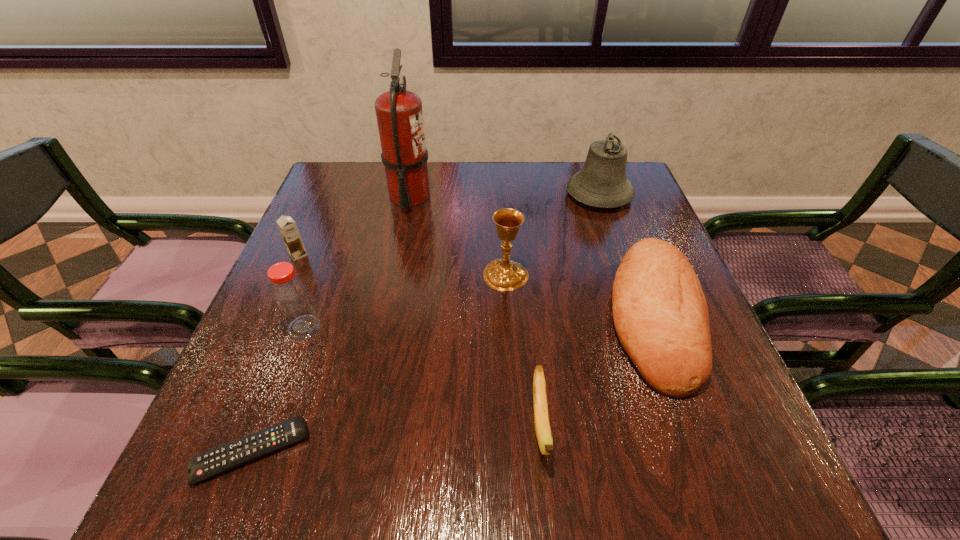
Find the location of a particular element. free space at the right edge of the desktop is located at coordinates (653, 420).

In the image, there is a desktop. Identify the location of vacant space at the far left corner. The image size is (960, 540). (358, 168).

At what (x,y) coordinates should I click in order to perform the action: click on vacant region between the bread and the chocolate milk. Please return your answer as a coordinate pair (x, y). Looking at the image, I should click on (476, 286).

The height and width of the screenshot is (540, 960). In order to click on free space that is in between the chalice and the chocolate milk in this screenshot , I will do `click(402, 265)`.

Find the location of a particular element. This screenshot has width=960, height=540. vacant space in between the chocolate milk and the banana is located at coordinates (420, 340).

At what (x,y) coordinates should I click in order to perform the action: click on free space between the bread and the seventh tallest object. Please return your answer as a coordinate pair (x, y). Looking at the image, I should click on (597, 372).

This screenshot has height=540, width=960. What are the coordinates of `vacant space that's between the chocolate milk and the bell` in the screenshot? It's located at (448, 225).

Where is `vacant space in between the shortest object and the fifth object from right to left`? Image resolution: width=960 pixels, height=540 pixels. vacant space in between the shortest object and the fifth object from right to left is located at coordinates (330, 325).

Identify the location of vacant area that lies between the chalice and the bottle. (405, 301).

This screenshot has width=960, height=540. Find the location of `unoccupied area between the bottle and the chalice`. unoccupied area between the bottle and the chalice is located at coordinates (405, 301).